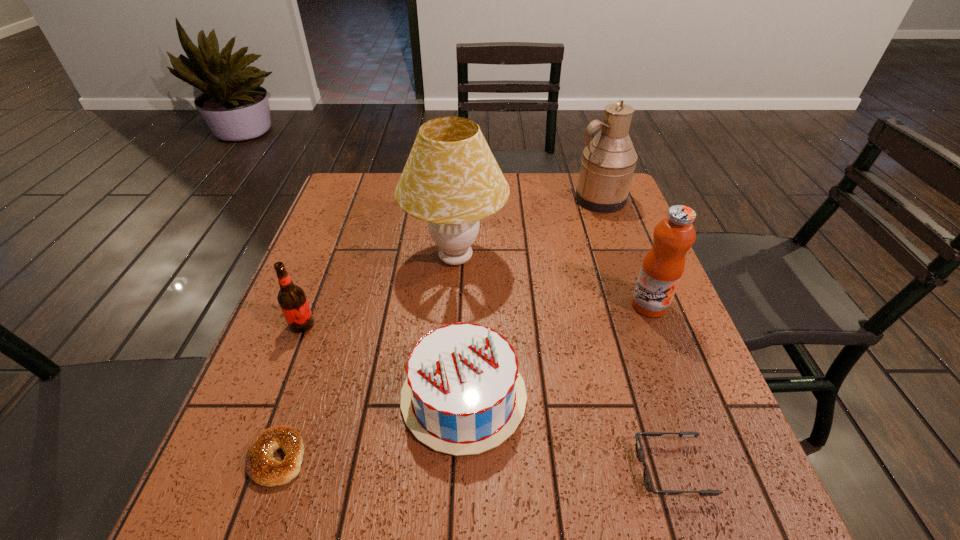
The image size is (960, 540). In the image, there is a desktop. In order to click on vacant space at the right edge in this screenshot , I will do `click(726, 478)`.

Locate an element on the screen. The height and width of the screenshot is (540, 960). free space at the far left corner is located at coordinates (385, 205).

Identify the location of free point at the near left corner. This screenshot has height=540, width=960. (272, 523).

The image size is (960, 540). In the image, there is a desktop. Identify the location of vacant space at the near right corner. (753, 485).

At what (x,y) coordinates should I click in order to perform the action: click on free space between the farthest object and the lampshade. Please return your answer as a coordinate pair (x, y). The image size is (960, 540). Looking at the image, I should click on coord(528,228).

Identify the location of blank region between the lampshade and the fruit juice. Image resolution: width=960 pixels, height=540 pixels. (552, 281).

Where is `free space between the root beer and the fruit juice`? free space between the root beer and the fruit juice is located at coordinates (475, 315).

The image size is (960, 540). What are the coordinates of `free space between the root beer and the fruit juice` in the screenshot? It's located at (475, 315).

Locate an element on the screen. This screenshot has height=540, width=960. free spot between the fourth shortest object and the lampshade is located at coordinates (379, 291).

Find the location of `unoccupied position between the farthest object and the sunglasses`. unoccupied position between the farthest object and the sunglasses is located at coordinates (636, 334).